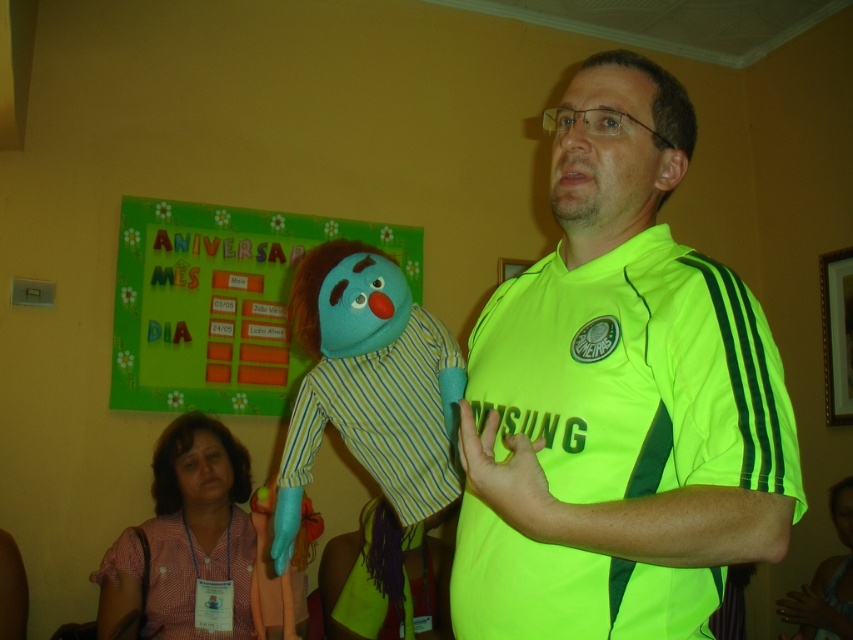
Which is above, green paperboard at upper center or blue fabric puppet at center?

Positioned higher is green paperboard at upper center.

Who is positioned more to the left, green paperboard at upper center or blue fabric puppet at center?

green paperboard at upper center is more to the left.

Between point (241, 284) and point (415, 396), which one is positioned in front?

Point (415, 396) is in front.

Find the location of a particular element. This screenshot has height=640, width=853. green paperboard at upper center is located at coordinates (219, 301).

Can you confirm if neon green jersey at center is wider than pink cotton shirt at lower left?

No, neon green jersey at center is not wider than pink cotton shirt at lower left.

Is point (500, 499) more distant than point (239, 602)?

No.

Is point (689, 260) positioned behind point (97, 580)?

No, it is not.

The image size is (853, 640). What are the coordinates of `neon green jersey at center` in the screenshot? It's located at point(618,397).

Is neon green jersey at center shorter than blue fabric puppet at center?

No, neon green jersey at center is not shorter than blue fabric puppet at center.

Is neon green jersey at center wider than blue fabric puppet at center?

Yes, neon green jersey at center is wider than blue fabric puppet at center.

Where is `neon green jersey at center`? neon green jersey at center is located at coordinates (618, 397).